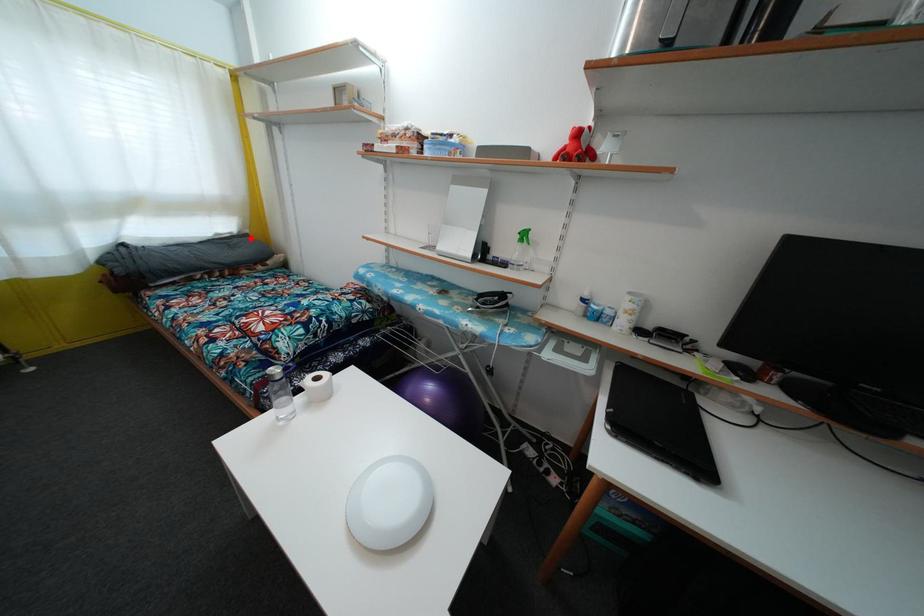
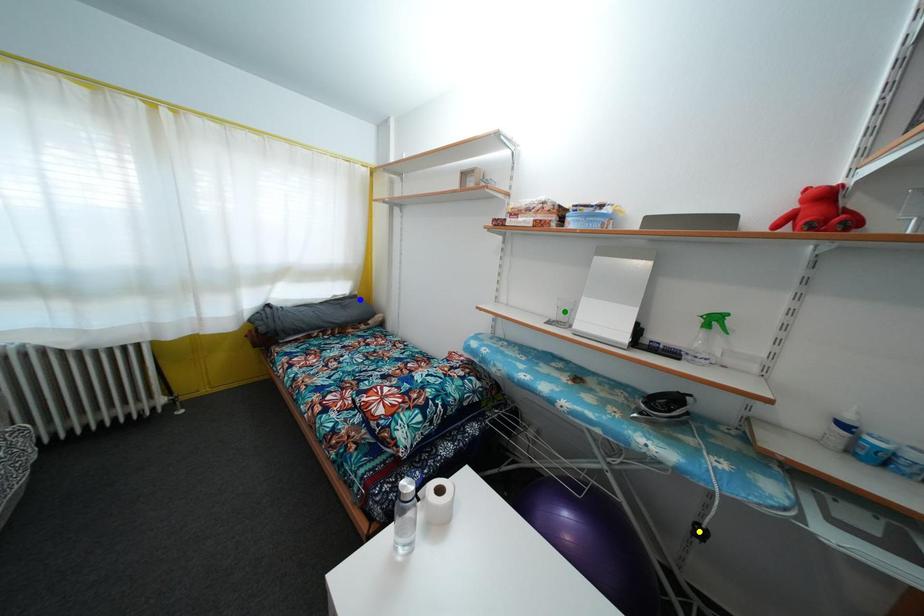
Question: I am providing you with two images of the same scene from different viewpoints. A red point is marked on the first image. You are given multiple points on the second image. Which point in image 2 represents the same 3d spot as the red point in image 1?

Choices:
 (A) yellow point
 (B) blue point
 (C) green point

Answer: (B)